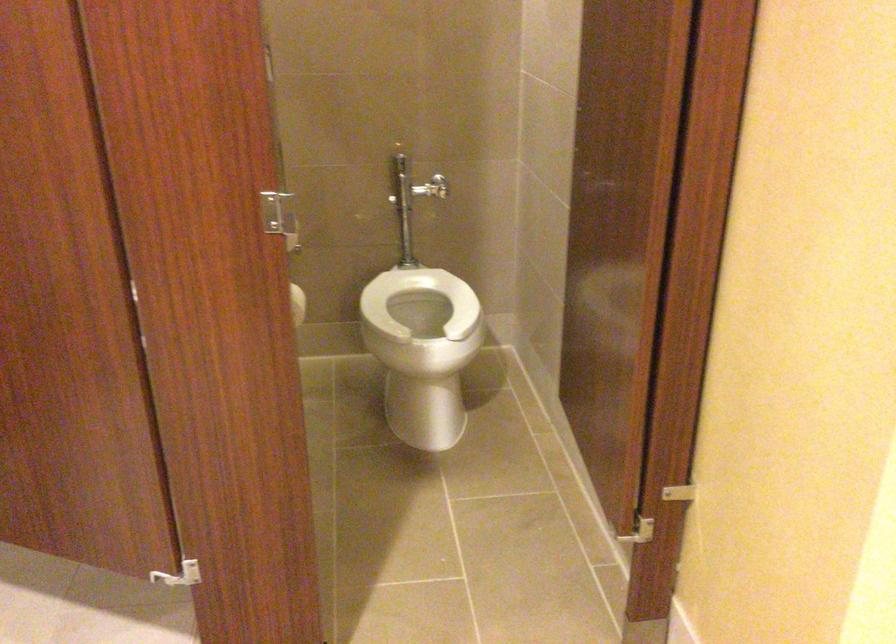
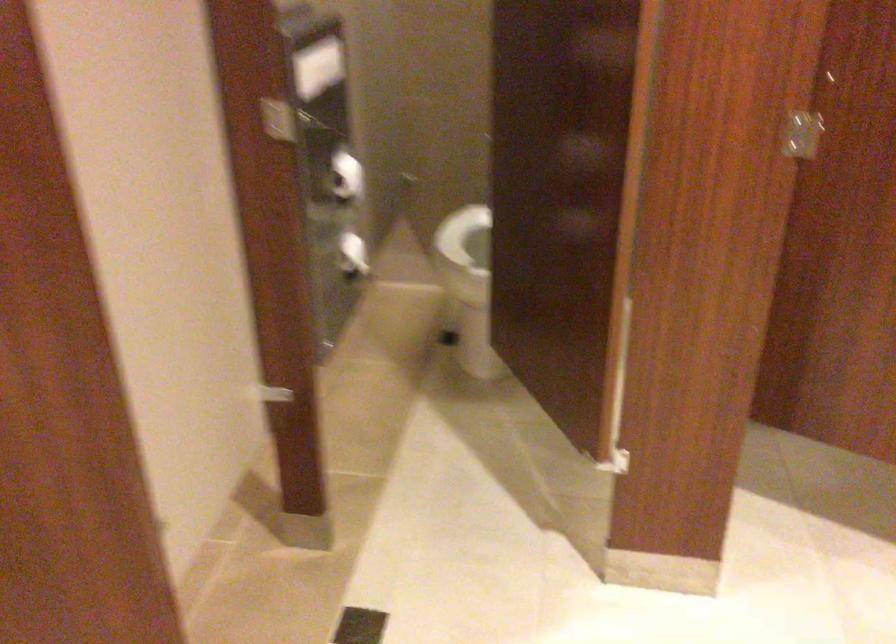
Question: Which direction would the cameraman need to move to produce the second image? Reply with the corresponding letter.

Choices:
 (A) Left
 (B) Right
 (C) Forward
 (D) Backward

Answer: (A)